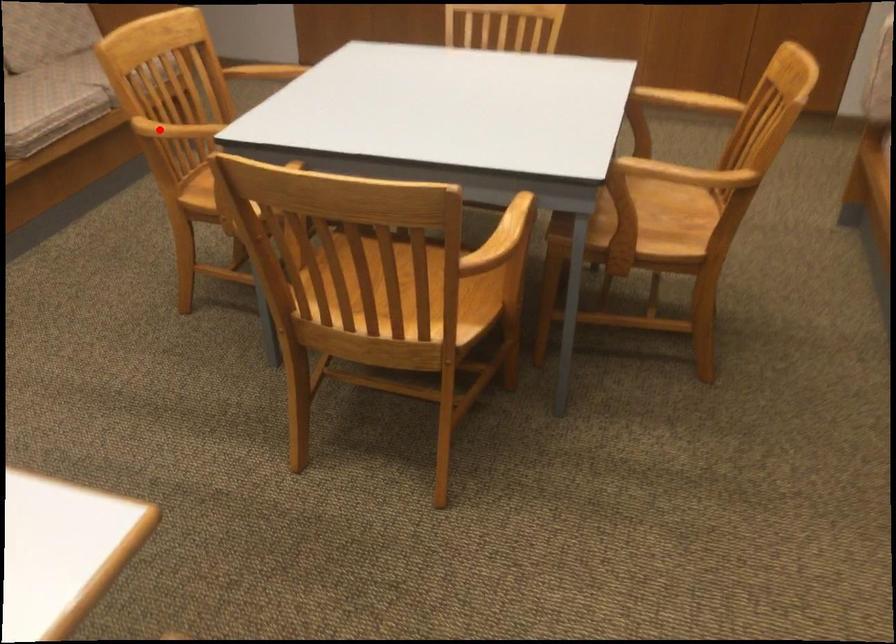
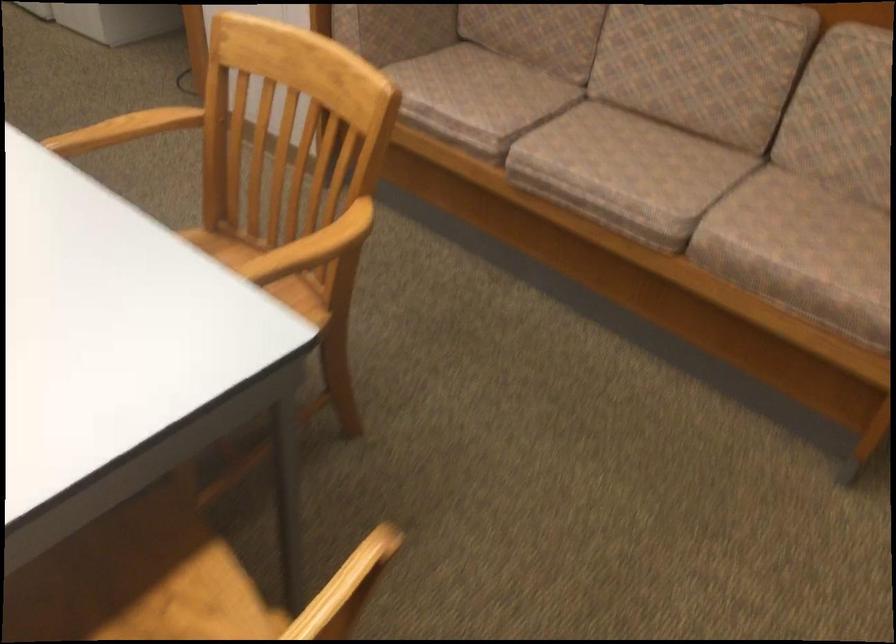
Question: I am providing you with two images of the same scene from different viewpoints. Given a red point in image1, look at the same physical point in image2. Is it:

Choices:
 (A) Closer to the viewpoint
 (B) Farther from the viewpoint

Answer: (A)